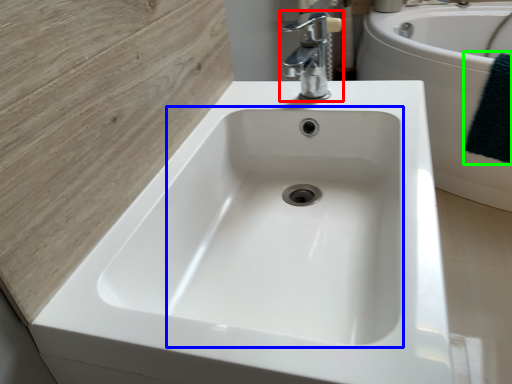
Question: Based on their relative distances, which object is farther from tap (highlighted by a red box)? Choose from sink (highlighted by a blue box) and bath towel (highlighted by a green box).

Choices:
 (A) sink
 (B) bath towel

Answer: (B)